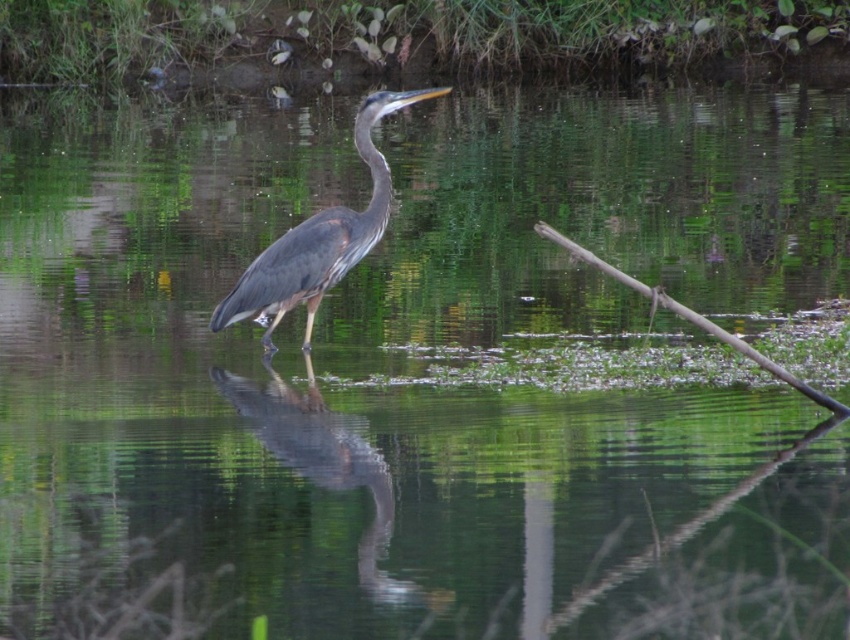
Question: Which point appears farthest from the camera in this image?

Choices:
 (A) (343, 433)
 (B) (367, 148)
 (C) (605, 264)

Answer: (A)

Question: Does shiny blue heron at center appear over gray matte heron at center?

Choices:
 (A) yes
 (B) no

Answer: (B)

Question: Which point appears closest to the camera in this image?

Choices:
 (A) (377, 120)
 (B) (236, 406)

Answer: (A)

Question: Which of the following is the farthest from the observer?

Choices:
 (A) shiny blue heron at center
 (B) brown wood branch at right
 (C) gray matte heron at center

Answer: (C)

Question: Can you confirm if shiny blue heron at center is positioned to the left of brown wood branch at right?

Choices:
 (A) yes
 (B) no

Answer: (A)

Question: In this image, where is gray matte heron at center located relative to brown wood branch at right?

Choices:
 (A) above
 (B) below

Answer: (A)